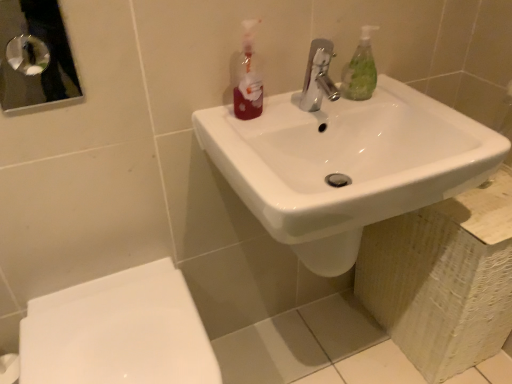
The width and height of the screenshot is (512, 384). Identify the location of free space in front of translucent plastic bottle at upper center. (241, 144).